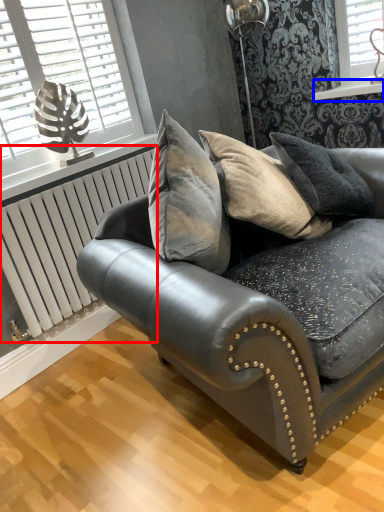
Question: Which object appears farthest to the camera in this image, radiator (highlighted by a red box) or window sill (highlighted by a blue box)?

Choices:
 (A) radiator
 (B) window sill

Answer: (B)